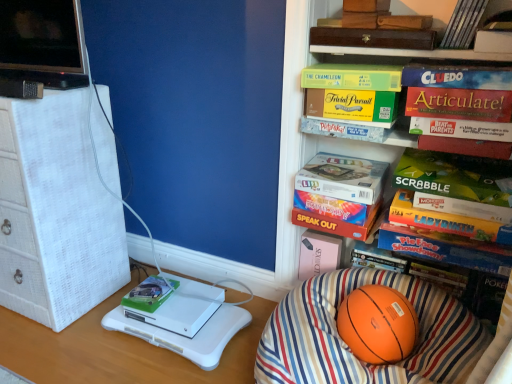
Locate an element on the screen. This screenshot has width=512, height=384. free point above white matte xbox at lower left (from a real-world perspective) is located at coordinates (175, 296).